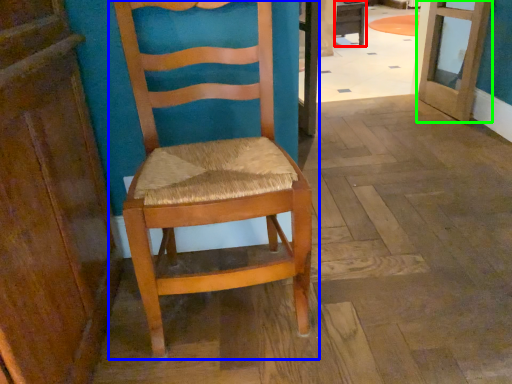
Question: Based on their relative distances, which object is nearer to table (highlighted by a red box)? Choose from chair (highlighted by a blue box) and door (highlighted by a green box).

Choices:
 (A) chair
 (B) door

Answer: (B)